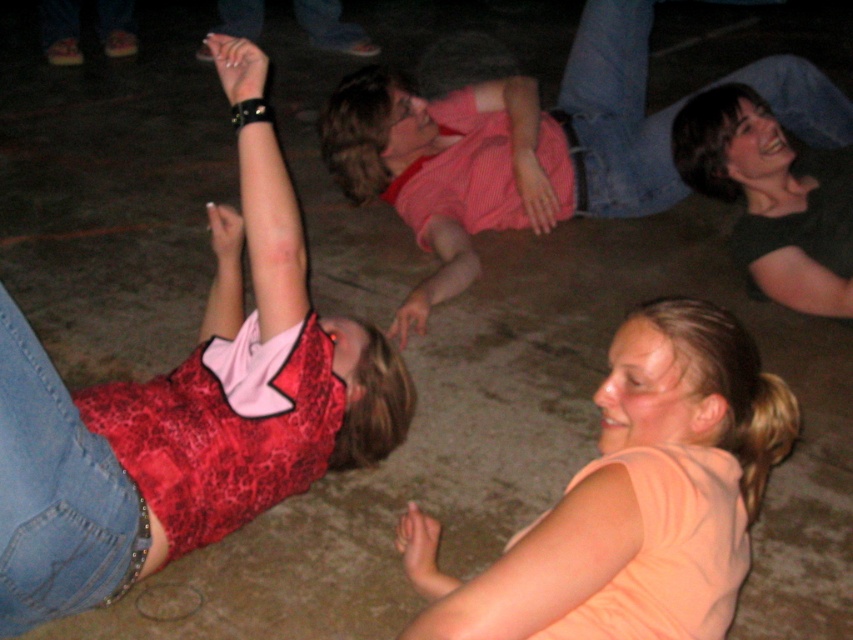
Does orange fabric shirt at lower right have a smaller size compared to pink lace shirt at center?

Indeed, orange fabric shirt at lower right has a smaller size compared to pink lace shirt at center.

Describe the element at coordinates (634, 497) in the screenshot. I see `orange fabric shirt at lower right` at that location.

Based on the photo, who is more forward, [459,625] or [666,145]?

Positioned in front is point [459,625].

I want to click on orange fabric shirt at lower right, so click(x=634, y=497).

Based on the photo, does red lace tank top at upper left appear on the right side of pink lace shirt at center?

Incorrect, red lace tank top at upper left is not on the right side of pink lace shirt at center.

Is red lace tank top at upper left closer to the viewer compared to pink lace shirt at center?

Yes.

Based on the photo, who is more distant from viewer, (13,381) or (651,129)?

Positioned behind is point (651,129).

This screenshot has height=640, width=853. I want to click on red lace tank top at upper left, so click(189, 404).

In the scene shown: Does red lace tank top at upper left appear under orange fabric shirt at lower right?

No.

Is red lace tank top at upper left above orange fabric shirt at lower right?

Indeed, red lace tank top at upper left is positioned over orange fabric shirt at lower right.

Between point (62, 387) and point (650, 460), which one is positioned behind?

Positioned behind is point (62, 387).

Find the location of a particular element. This screenshot has width=853, height=640. red lace tank top at upper left is located at coordinates (189, 404).